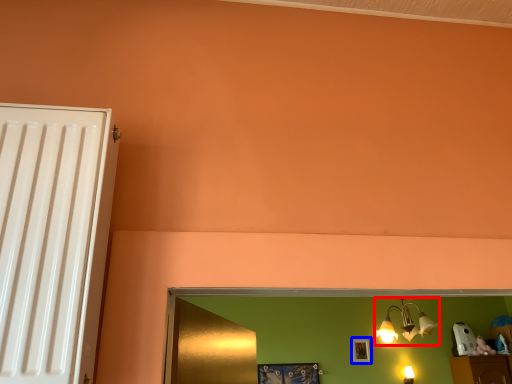
Question: Which of the following is the closest to the observer, lamp (highlighted by a red box) or picture frame (highlighted by a blue box)?

Choices:
 (A) lamp
 (B) picture frame

Answer: (A)